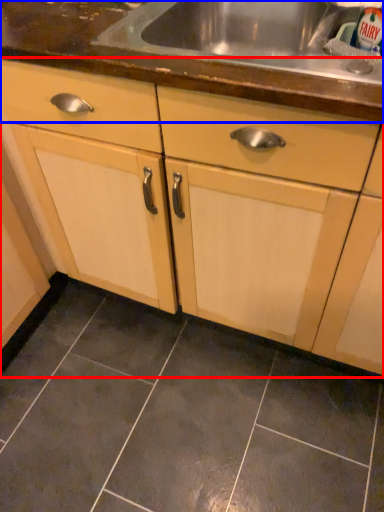
Question: Which of the following is the farthest to the observer, cabinetry (highlighted by a red box) or countertop (highlighted by a blue box)?

Choices:
 (A) cabinetry
 (B) countertop

Answer: (B)